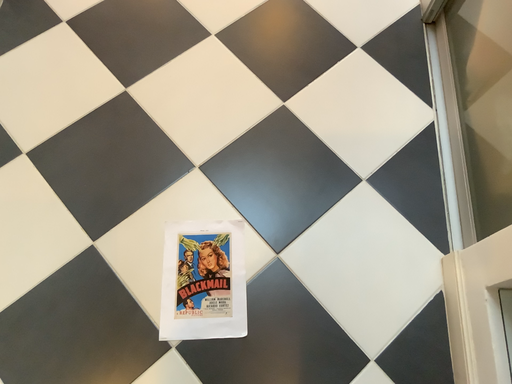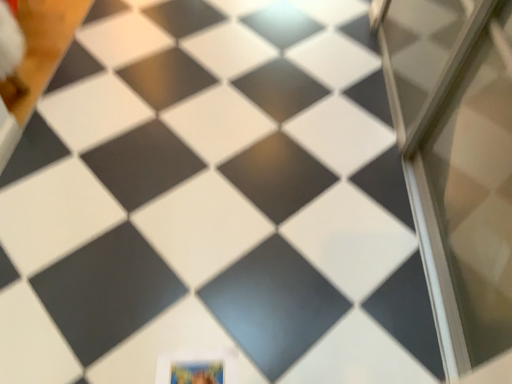
Question: How did the camera likely rotate when shooting the video?

Choices:
 (A) rotated downward
 (B) rotated upward

Answer: (B)